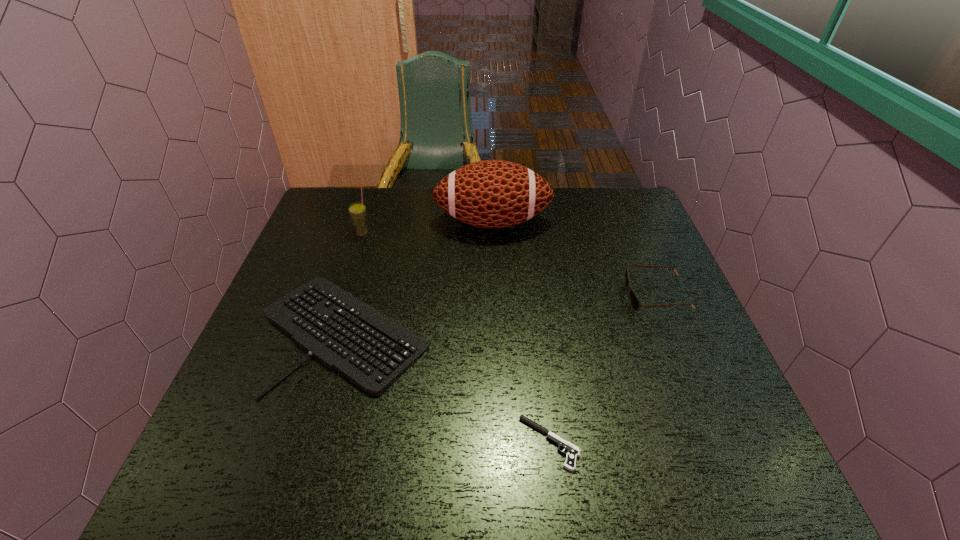
Image resolution: width=960 pixels, height=540 pixels. Find the location of `football`. football is located at coordinates (491, 193).

The width and height of the screenshot is (960, 540). I want to click on the fourth shortest object, so click(358, 213).

This screenshot has width=960, height=540. What are the coordinates of `the rightmost object` in the screenshot? It's located at (635, 303).

Identify the location of the third tallest object. (635, 303).

This screenshot has height=540, width=960. Find the location of `computer keyboard`. computer keyboard is located at coordinates (370, 349).

The height and width of the screenshot is (540, 960). I want to click on the shortest object, so click(572, 452).

The image size is (960, 540). I want to click on pistol, so click(572, 452).

You are a GUI agent. You are given a task and a screenshot of the screen. Output one action in this format:
    pyautogui.click(x=<x>, y=<y>)
    Task: Click on the blank space located 0.170m on the front of the tallest object
    
    Given the screenshot: What is the action you would take?
    pyautogui.click(x=494, y=282)

This screenshot has width=960, height=540. In order to click on blank space located on the right of the straw for drinking in this screenshot , I will do pyautogui.click(x=415, y=234).

Image resolution: width=960 pixels, height=540 pixels. In order to click on free point located 0.300m on the lenses of the rightmost object in this screenshot , I will do click(508, 296).